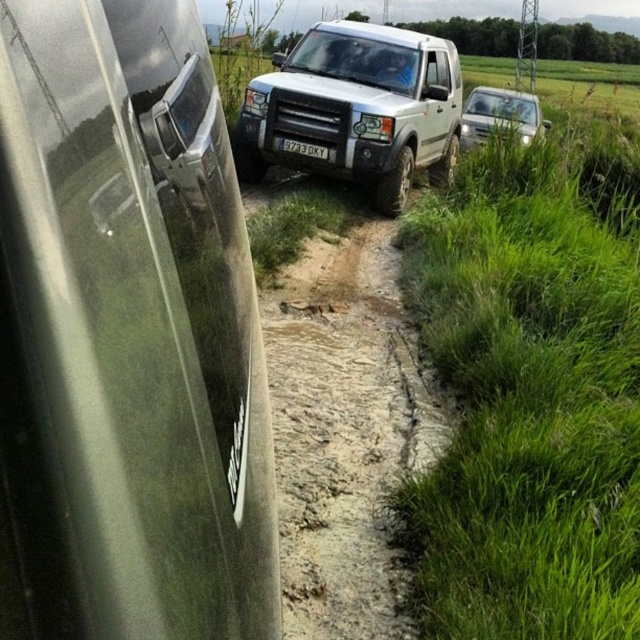
Question: Which point is farther from the camera taking this photo?

Choices:
 (A) (26, 145)
 (B) (480, 132)
 (C) (296, 154)
 (D) (400, 131)

Answer: (B)

Question: Does white matte suv at center appear under white plastic license plate at center?

Choices:
 (A) yes
 (B) no

Answer: (A)

Question: Among these objects, which one is nearest to the camera?

Choices:
 (A) white plastic license plate at center
 (B) white matte jeep at center

Answer: (B)

Question: Does white matte suv at center appear over white plastic license plate at center?

Choices:
 (A) yes
 (B) no

Answer: (B)

Question: Estimate the real-world distances between objects in this image. Which object is farther from the white matte car at upper right?

Choices:
 (A) brown sandy dirt track at center
 (B) green grass at center
 (C) white matte jeep at center

Answer: (A)

Question: Can you confirm if white matte suv at center is positioned above brown sandy dirt track at center?

Choices:
 (A) no
 (B) yes

Answer: (B)